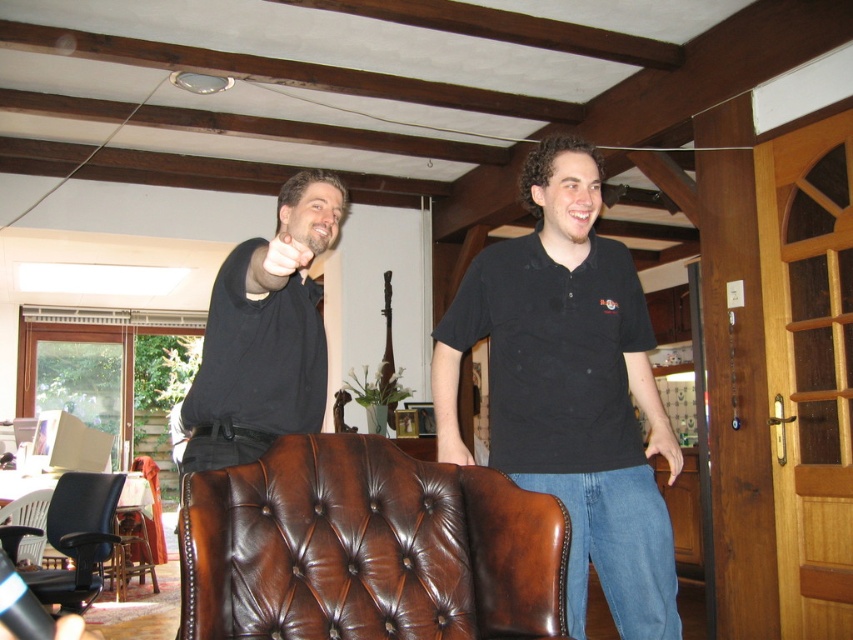
Is brown leather armchair at center positioned in front of matte black shirt at center?

Yes, brown leather armchair at center is closer to the viewer.

Can you confirm if brown leather armchair at center is taller than matte black shirt at center?

No, brown leather armchair at center is not taller than matte black shirt at center.

Identify the location of brown leather armchair at center. This screenshot has width=853, height=640. (367, 548).

Locate an element on the screen. brown leather armchair at center is located at coordinates (367, 548).

Can you confirm if matte black shirt at center is bigger than black leather shirt at center?

Indeed, matte black shirt at center has a larger size compared to black leather shirt at center.

Is point (640, 554) positioned in front of point (223, 396)?

No, it is not.

Locate an element on the screen. matte black shirt at center is located at coordinates (570, 388).

Is brown leather armchair at center above black cotton shirt at center?

No.

Is point (305, 628) positioned before point (607, 433)?

Yes.

The width and height of the screenshot is (853, 640). What are the coordinates of `brown leather armchair at center` in the screenshot? It's located at (367, 548).